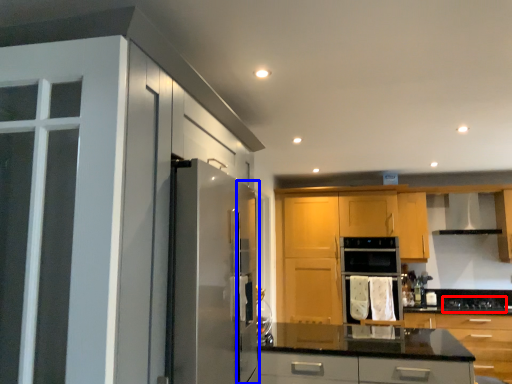
Question: Which point is closer to the camera, gas stove (highlighted by a red box) or screen door (highlighted by a blue box)?

Choices:
 (A) gas stove
 (B) screen door

Answer: (B)